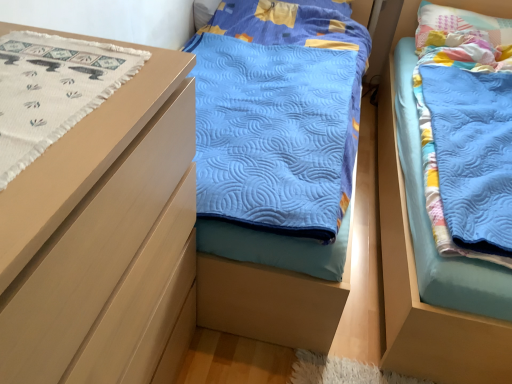
Question: Can we say white woven fabric at left lies outside matte wood chest of drawers at left?

Choices:
 (A) no
 (B) yes

Answer: (A)

Question: From the image's perspective, would you say white woven fabric at left is positioned over matte wood chest of drawers at left?

Choices:
 (A) yes
 (B) no

Answer: (A)

Question: Can you confirm if white woven fabric at left is smaller than matte wood chest of drawers at left?

Choices:
 (A) yes
 (B) no

Answer: (A)

Question: Does white woven fabric at left turn towards matte wood chest of drawers at left?

Choices:
 (A) no
 (B) yes

Answer: (B)

Question: Is white woven fabric at left facing away from matte wood chest of drawers at left?

Choices:
 (A) yes
 (B) no

Answer: (A)

Question: Does white woven fabric at left have a greater height compared to matte wood chest of drawers at left?

Choices:
 (A) no
 (B) yes

Answer: (A)

Question: Considering the relative sizes of blue quilted blanket at right and white woven fabric at left in the image provided, is blue quilted blanket at right smaller than white woven fabric at left?

Choices:
 (A) no
 (B) yes

Answer: (A)

Question: Is blue quilted blanket at right at the right side of white woven fabric at left?

Choices:
 (A) yes
 (B) no

Answer: (A)

Question: Is blue quilted blanket at right next to white woven fabric at left and touching it?

Choices:
 (A) no
 (B) yes

Answer: (A)

Question: Can you confirm if blue quilted blanket at right is thinner than white woven fabric at left?

Choices:
 (A) no
 (B) yes

Answer: (A)

Question: From a real-world perspective, is blue quilted blanket at right positioned under white woven fabric at left based on gravity?

Choices:
 (A) no
 (B) yes

Answer: (B)

Question: Considering the relative sizes of blue quilted blanket at right and white woven fabric at left in the image provided, is blue quilted blanket at right taller than white woven fabric at left?

Choices:
 (A) no
 (B) yes

Answer: (B)

Question: Is blue quilted blanket at right positioned in front of pastel patchwork pillow at upper right?

Choices:
 (A) no
 (B) yes

Answer: (B)